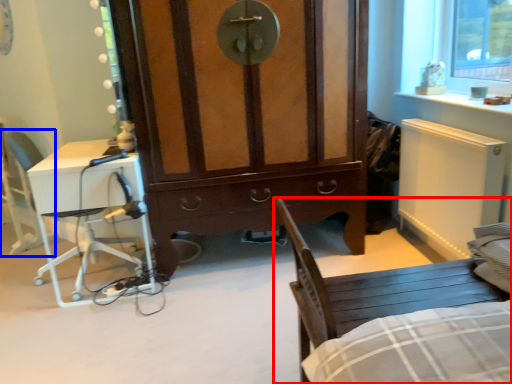
Question: Which of the following is the farthest to the observer, chair (highlighted by a red box) or armchair (highlighted by a blue box)?

Choices:
 (A) chair
 (B) armchair

Answer: (B)